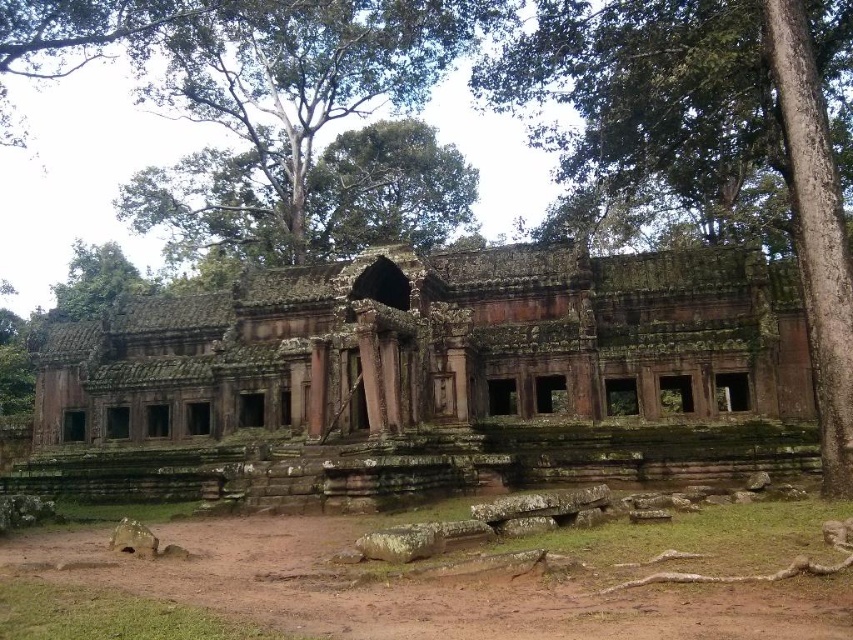
Can you confirm if green rough bark tree at upper center is bigger than green leafy tree at upper center?

Actually, green rough bark tree at upper center might be smaller than green leafy tree at upper center.

Who is lower down, green rough bark tree at upper center or green leafy tree at upper center?

green rough bark tree at upper center

Identify the location of green rough bark tree at upper center. The width and height of the screenshot is (853, 640). (711, 132).

Does pink stone ruins at center have a lesser height compared to green rough bark tree at upper center?

Correct, pink stone ruins at center is not as tall as green rough bark tree at upper center.

Can you confirm if pink stone ruins at center is positioned above green rough bark tree at upper center?

Incorrect, pink stone ruins at center is not positioned above green rough bark tree at upper center.

Describe the element at coordinates (433, 378) in the screenshot. I see `pink stone ruins at center` at that location.

Where is `pink stone ruins at center`? This screenshot has width=853, height=640. pink stone ruins at center is located at coordinates (433, 378).

Between pink stone ruins at center and green leafy tree at upper center, which one has more height?

Standing taller between the two is green leafy tree at upper center.

Can you confirm if pink stone ruins at center is positioned below green leafy tree at upper center?

Yes, pink stone ruins at center is below green leafy tree at upper center.

Who is more distant from viewer, (775, 369) or (320, 22)?

Point (320, 22)

The image size is (853, 640). I want to click on pink stone ruins at center, so click(x=433, y=378).